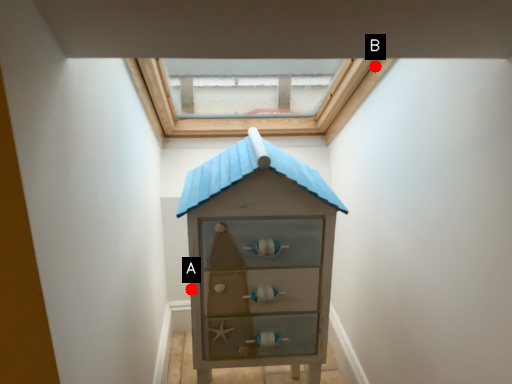
Question: Two points are circled on the image, labeled by A and B beside each circle. Which point is further to the camera?

Choices:
 (A) A is further
 (B) B is further

Answer: (A)